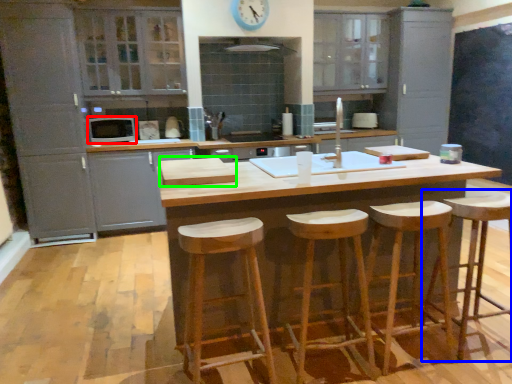
Question: Which object is the closest to the appliance (highlighted by a red box)? Choose among these: bar stool (highlighted by a blue box) or wood (highlighted by a green box).

Choices:
 (A) bar stool
 (B) wood

Answer: (B)